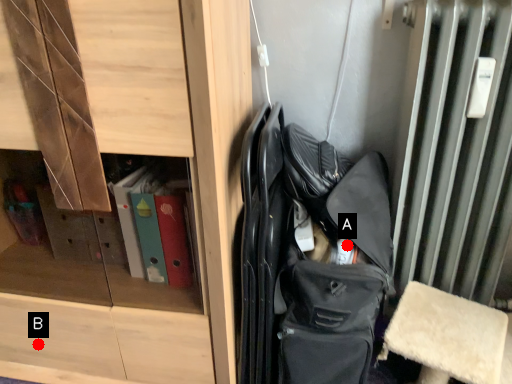
Question: Two points are circled on the image, labeled by A and B beside each circle. Which point appears farthest from the camera in this image?

Choices:
 (A) A is further
 (B) B is further

Answer: (B)